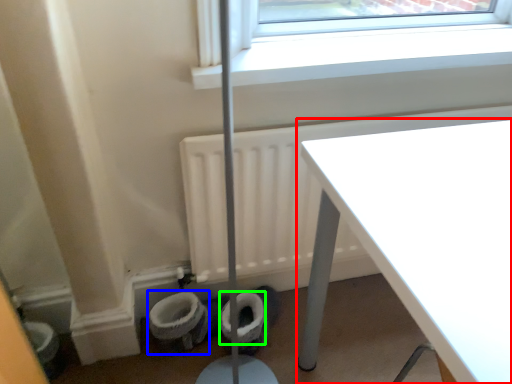
Question: Estimate the real-world distances between objects in this image. Which object is closer to table (highlighted by a red box), toilet bowl (highlighted by a blue box) or toilet paper (highlighted by a green box)?

Choices:
 (A) toilet bowl
 (B) toilet paper

Answer: (B)